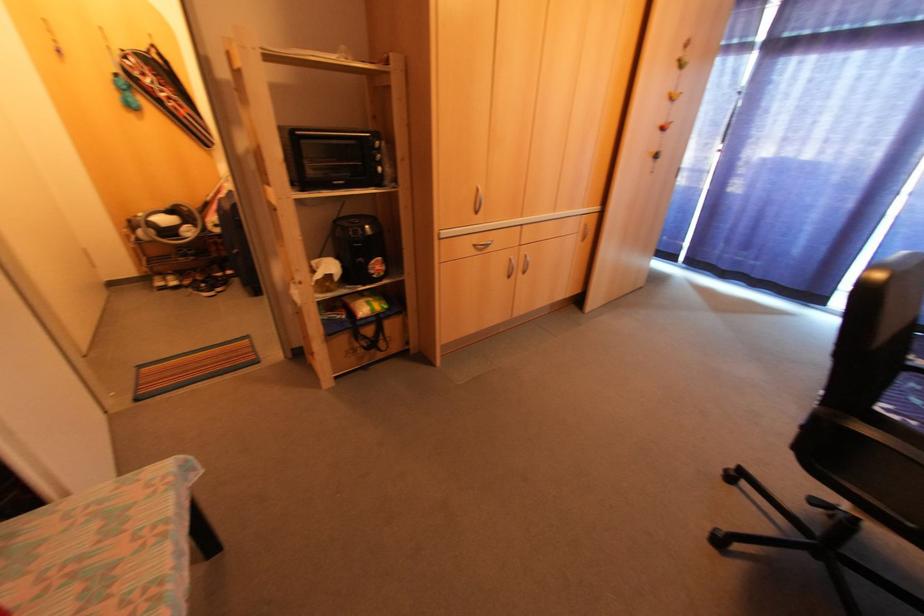
You are a GUI agent. You are given a task and a screenshot of the screen. Output one action in this format:
    pyautogui.click(x=<x>, y=<y>)
    Task: Click on the chair sitting surface
    This screenshot has height=616, width=924.
    Given the screenshot: What is the action you would take?
    pyautogui.click(x=877, y=471)